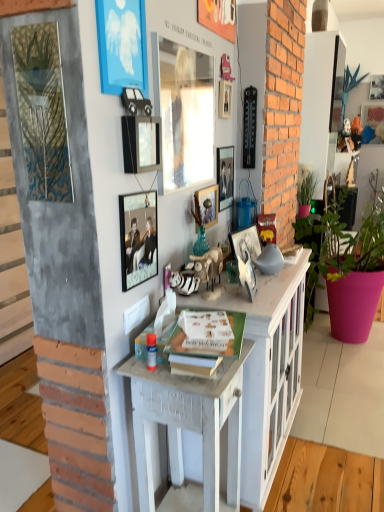
Looking at this image, measure the distance between point (202, 467) and camera.

Point (202, 467) is 5.38 feet away from camera.

The height and width of the screenshot is (512, 384). What do you see at coordinates (267, 371) in the screenshot? I see `white wood cabinet at center` at bounding box center [267, 371].

What is the approximate height of metallic silver picture frame at center, acting as the 8th picture frame starting from the left?

metallic silver picture frame at center, acting as the 8th picture frame starting from the left, is 7.13 inches tall.

Where is `metallic silver picture frame at upper center, arranged as the 8th picture frame when viewed from the back`? This screenshot has width=384, height=512. metallic silver picture frame at upper center, arranged as the 8th picture frame when viewed from the back is located at coordinates (141, 143).

What do you see at coordinates (306, 194) in the screenshot? I see `green matte plant at right, arranged as the second houseplant when viewed from the right` at bounding box center [306, 194].

What do you see at coordinates (42, 111) in the screenshot? Image resolution: width=384 pixels, height=512 pixels. I see `metallic gold picture frame at left, which is counted as the 10th picture frame, starting from the back` at bounding box center [42, 111].

At what (x,y) coordinates should I click in order to perform the action: click on metallic gold picture frame at left, which is counted as the 10th picture frame, starting from the back. Please return your answer as a coordinate pair (x, y). This screenshot has width=384, height=512. Looking at the image, I should click on (42, 111).

Find the location of a particular element. The height and width of the screenshot is (512, 384). white wood cabinet at center is located at coordinates (267, 371).

How distant is metallic silver picture frame at center, acting as the 8th picture frame starting from the left, from metallic gold picture frame at left, the 10th picture frame viewed from the right?

metallic silver picture frame at center, acting as the 8th picture frame starting from the left, is 33.74 inches away from metallic gold picture frame at left, the 10th picture frame viewed from the right.

Is metallic silver picture frame at center, acting as the 8th picture frame starting from the left, with metallic gold picture frame at left, which is counted as the 10th picture frame, starting from the back?

They are not placed beside each other.

In the scene shown: Who is smaller, metallic silver picture frame at center, which is counted as the 6th picture frame, starting from the front, or metallic gold picture frame at left, the 10th picture frame viewed from the right?

metallic gold picture frame at left, the 10th picture frame viewed from the right.

From the picture: Does metallic silver picture frame at center, acting as the 8th picture frame starting from the left, have a greater height compared to metallic gold picture frame at left, which is counted as the first picture frame, starting from the front?

Incorrect, the height of metallic silver picture frame at center, acting as the 8th picture frame starting from the left, is not larger of that of metallic gold picture frame at left, which is counted as the first picture frame, starting from the front.

Can you tell me how much metallic silver picture frame at center, which is counted as the 6th picture frame, starting from the front, and blue matte picture frame at upper center, positioned as the ninth picture frame in back-to-front order, differ in facing direction?

There is a 9.67-degree angle between the facing directions of metallic silver picture frame at center, which is counted as the 6th picture frame, starting from the front, and blue matte picture frame at upper center, positioned as the ninth picture frame in back-to-front order.

Does point (250, 251) appear closer or farther from the camera than point (135, 40)?

Point (250, 251) appears to be farther away from the viewer than point (135, 40).

Considering the relative sizes of metallic silver picture frame at center, the 3th picture frame when ordered from right to left, and blue matte picture frame at upper center, the 2th picture frame positioned from the front, in the image provided, is metallic silver picture frame at center, the 3th picture frame when ordered from right to left, thinner than blue matte picture frame at upper center, the 2th picture frame positioned from the front,?

No.

Is metallic silver picture frame at center, acting as the seventh picture frame starting from the back, not inside blue matte picture frame at upper center, positioned as the ninth picture frame in back-to-front order?

metallic silver picture frame at center, acting as the seventh picture frame starting from the back, lies outside blue matte picture frame at upper center, positioned as the ninth picture frame in back-to-front order,'s area.

From the image's perspective, who appears lower, metallic silver picture frame at center, positioned as the eighth picture frame in right-to-left order, or blue matte picture frame at upper center, the 2th picture frame positioned from the front?

metallic silver picture frame at center, positioned as the eighth picture frame in right-to-left order, is shown below in the image.

Could you tell me if metallic silver picture frame at center, positioned as the eighth picture frame in right-to-left order, is turned towards blue matte picture frame at upper center, positioned as the ninth picture frame in back-to-front order?

No.

Is point (143, 438) positioned behind point (177, 91)?

Yes, it is.

Based on the photo, would you say white wood cabinet at center is a long distance from matte glass picture frame at upper center, the fifth picture frame when ordered from left to right?

They are positioned close to each other.

From the image's perspective, is white wood cabinet at center positioned above or below matte glass picture frame at upper center, which is the sixth picture frame from right to left?

From the image's perspective, white wood cabinet at center appears below matte glass picture frame at upper center, which is the sixth picture frame from right to left.

Relative to matte glass picture frame at upper center, positioned as the fifth picture frame in front-to-back order, is white wood cabinet at center in front or behind?

Visually, white wood cabinet at center is located behind matte glass picture frame at upper center, positioned as the fifth picture frame in front-to-back order.

In terms of size, does green matte plant at right, which ranks as the 1th houseplant in left-to-right order, appear bigger or smaller than metallic silver picture frame at upper center, which is the 3th picture frame in front-to-back order?

Clearly, green matte plant at right, which ranks as the 1th houseplant in left-to-right order, is larger in size than metallic silver picture frame at upper center, which is the 3th picture frame in front-to-back order.

Measure the distance from green matte plant at right, arranged as the second houseplant when viewed from the right, to metallic silver picture frame at upper center, the 4th picture frame positioned from the left.

green matte plant at right, arranged as the second houseplant when viewed from the right, and metallic silver picture frame at upper center, the 4th picture frame positioned from the left, are 2.14 meters apart from each other.

Considering the relative positions of green matte plant at right, which ranks as the 1th houseplant in left-to-right order, and metallic silver picture frame at upper center, the 4th picture frame positioned from the left, in the image provided, is green matte plant at right, which ranks as the 1th houseplant in left-to-right order, to the left of metallic silver picture frame at upper center, the 4th picture frame positioned from the left, from the viewer's perspective?

No.

From a real-world perspective, is green matte plant at right, which ranks as the 1th houseplant in left-to-right order, physically located above or below metallic silver picture frame at upper center, the 4th picture frame positioned from the left?

Clearly, from a real-world perspective, green matte plant at right, which ranks as the 1th houseplant in left-to-right order, is below metallic silver picture frame at upper center, the 4th picture frame positioned from the left.

Can you confirm if white wood cabinet at center is wider than metallic silver photo frame at center, positioned as the eighth picture frame in front-to-back order?

Yes.

Does white wood cabinet at center turn towards metallic silver photo frame at center, the 7th picture frame positioned from the left?

No, white wood cabinet at center is not aimed at metallic silver photo frame at center, the 7th picture frame positioned from the left.

From the image's perspective, is white wood cabinet at center below metallic silver photo frame at center, the 7th picture frame positioned from the left?

Correct, white wood cabinet at center appears lower than metallic silver photo frame at center, the 7th picture frame positioned from the left, in the image.

Is white wood cabinet at center touching metallic silver photo frame at center, the fourth picture frame when ordered from right to left?

There is a gap between white wood cabinet at center and metallic silver photo frame at center, the fourth picture frame when ordered from right to left.

Does metallic silver picture frame at center, the third picture frame viewed from the left, have a lesser width compared to matte glass picture frame at center, acting as the seventh picture frame starting from the front?

Indeed, metallic silver picture frame at center, the third picture frame viewed from the left, has a lesser width compared to matte glass picture frame at center, acting as the seventh picture frame starting from the front.

From the image's perspective, is metallic silver picture frame at center, positioned as the eighth picture frame in right-to-left order, located beneath matte glass picture frame at center, acting as the 4th picture frame starting from the back?

Correct, metallic silver picture frame at center, positioned as the eighth picture frame in right-to-left order, appears lower than matte glass picture frame at center, acting as the 4th picture frame starting from the back, in the image.

In order to click on the 3rd picture frame to the left of the matte glass picture frame at center, acting as the 4th picture frame starting from the back, starting your count from the anchor in this screenshot , I will do `click(138, 237)`.

Image resolution: width=384 pixels, height=512 pixels. What are the coordinates of `the 5th picture frame behind the metallic gold picture frame at left, the 1th picture frame positioned from the left, counting from the anchor's position` in the screenshot? It's located at (246, 242).

From the metallic silver picture frame at center, the 3th picture frame when ordered from right to left, count 4th picture frames forward and point to it. Please provide its 2D coordinates.

[(122, 45)]

Looking at the image, which one is located further to wooden desk at center, matte glass picture frame at center, acting as the seventh picture frame starting from the front, or pink matte pot at right, which appears as the second houseplant when viewed from the left?

Among the two, pink matte pot at right, which appears as the second houseplant when viewed from the left, is located further to wooden desk at center.

From the image, which object appears to be nearer to green matte plant at right, which ranks as the 1th houseplant in left-to-right order, matte glass picture frame at upper center, positioned as the fifth picture frame in front-to-back order, or metallic silver picture frame at upper right, acting as the 1th picture frame starting from the right?

The object closer to green matte plant at right, which ranks as the 1th houseplant in left-to-right order, is metallic silver picture frame at upper right, acting as the 1th picture frame starting from the right.

Which object lies nearer to the anchor point wooden picture frame at upper right, which is the 1th picture frame from back to front, white wood cabinet at center or wooden desk at center?

white wood cabinet at center is closer to wooden picture frame at upper right, which is the 1th picture frame from back to front.

When comparing their distances from white wood cabinet at center, does pink matte pot at right, which appears as the second houseplant when viewed from the left, or metallic gold picture frame at left, the 1th picture frame positioned from the left, seem further?

pink matte pot at right, which appears as the second houseplant when viewed from the left, is further to white wood cabinet at center.

Estimate the real-world distances between objects in this image. Which object is closer to metallic silver picture frame at upper right, which is counted as the ninth picture frame, starting from the front, matte glass picture frame at center, acting as the seventh picture frame starting from the front, or blue matte picture frame at upper center, the second picture frame viewed from the left?

matte glass picture frame at center, acting as the seventh picture frame starting from the front, lies closer to metallic silver picture frame at upper right, which is counted as the ninth picture frame, starting from the front, than the other object.

Considering their positions, is metallic silver picture frame at upper center, which is the 3th picture frame in front-to-back order, positioned further to metallic silver picture frame at center, the third picture frame viewed from the left, than blue matte picture frame at upper center, placed as the 9th picture frame when sorted from right to left?

The object further to metallic silver picture frame at center, the third picture frame viewed from the left, is blue matte picture frame at upper center, placed as the 9th picture frame when sorted from right to left.

Considering their positions, is wooden desk at center positioned further to metallic silver picture frame at center, acting as the 8th picture frame starting from the left, than white wood cabinet at center?

The object further to metallic silver picture frame at center, acting as the 8th picture frame starting from the left, is wooden desk at center.

Which object lies further to the anchor point metallic silver picture frame at upper center, the 4th picture frame positioned from the left, metallic silver picture frame at center, which is counted as the 6th picture frame, starting from the front, or blue matte picture frame at upper center, the second picture frame viewed from the left?

metallic silver picture frame at center, which is counted as the 6th picture frame, starting from the front.

The width and height of the screenshot is (384, 512). Find the location of `cabinetry located between blue matte picture frame at upper center, the 2th picture frame positioned from the front, and wooden picture frame at upper right, positioned as the second picture frame in right-to-left order, in the depth direction`. cabinetry located between blue matte picture frame at upper center, the 2th picture frame positioned from the front, and wooden picture frame at upper right, positioned as the second picture frame in right-to-left order, in the depth direction is located at coordinates (267, 371).

Identify the location of cabinetry situated between metallic gold picture frame at left, the 1th picture frame positioned from the left, and pink matte pot at right, placed as the first houseplant when sorted from right to left, from left to right. This screenshot has width=384, height=512. pos(267,371).

At what (x,y) coordinates should I click in order to perform the action: click on cabinetry located between metallic silver picture frame at center, positioned as the eighth picture frame in right-to-left order, and wooden picture frame at upper right, positioned as the second picture frame in right-to-left order, in the depth direction. Please return your answer as a coordinate pair (x, y). The image size is (384, 512). Looking at the image, I should click on (267, 371).

At what (x,y) coordinates should I click in order to perform the action: click on cabinetry positioned between metallic gold picture frame at left, the 10th picture frame viewed from the right, and wooden picture frame at upper right, placed as the tenth picture frame when sorted from front to back, from near to far. Please return your answer as a coordinate pair (x, y). The width and height of the screenshot is (384, 512). Looking at the image, I should click on (267, 371).